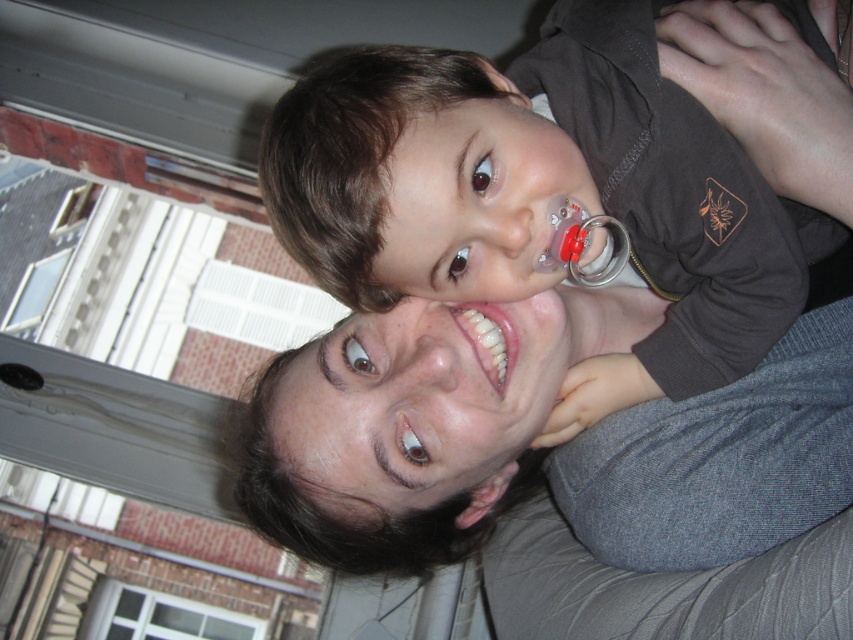
Does matte brown shirt at upper center appear over white glossy teeth at center?

Yes, matte brown shirt at upper center is above white glossy teeth at center.

What do you see at coordinates (541, 195) in the screenshot?
I see `matte brown shirt at upper center` at bounding box center [541, 195].

Image resolution: width=853 pixels, height=640 pixels. Identify the location of matte brown shirt at upper center. (541, 195).

Is point (268, 211) positioned in front of point (660, 442)?

Yes.

Is the position of matte brown shirt at upper center more distant than that of smooth gray sweater at center?

No, it is not.

Between point (457, 122) and point (268, 531), which one is positioned behind?

The point (268, 531) is behind.

Locate an element on the screen. matte brown shirt at upper center is located at coordinates (541, 195).

Image resolution: width=853 pixels, height=640 pixels. Describe the element at coordinates (376, 452) in the screenshot. I see `smooth gray sweater at center` at that location.

Between point (701, 486) and point (466, 332), which one is positioned in front?

Positioned in front is point (701, 486).

Which is behind, point (422, 566) or point (508, 326)?

Point (422, 566)

You are a GUI agent. You are given a task and a screenshot of the screen. Output one action in this format:
    pyautogui.click(x=<x>, y=<y>)
    Task: Click on the smooth gray sweater at center
    Image resolution: width=853 pixels, height=640 pixels.
    Given the screenshot: What is the action you would take?
    pyautogui.click(x=376, y=452)